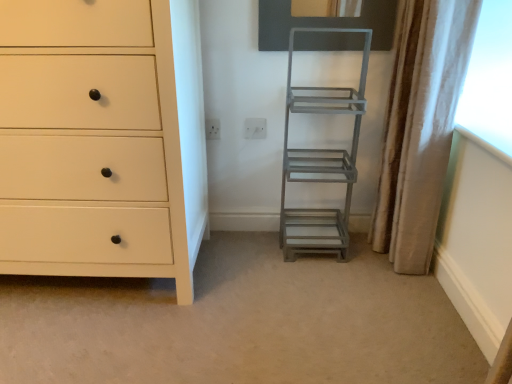
Where is `vacant area that lies between gray matte metal ladder at center-right and matte white chest of drawers at left`? vacant area that lies between gray matte metal ladder at center-right and matte white chest of drawers at left is located at coordinates (254, 261).